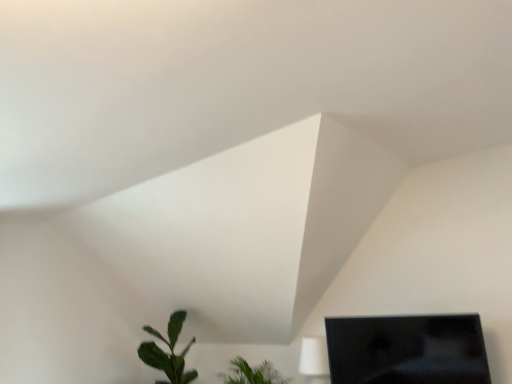
Question: From a real-world perspective, does black glossy monitor at lower right stand above green matte leafy plant at lower left, which appears as the 2th houseplant when viewed from the right?

Choices:
 (A) yes
 (B) no

Answer: (A)

Question: Is black glossy monitor at lower right aimed at green matte leafy plant at lower left, which appears as the 2th houseplant when viewed from the right?

Choices:
 (A) no
 (B) yes

Answer: (A)

Question: Does black glossy monitor at lower right have a larger size compared to green matte leafy plant at lower left, which appears as the 2th houseplant when viewed from the right?

Choices:
 (A) yes
 (B) no

Answer: (B)

Question: Is black glossy monitor at lower right next to green matte leafy plant at lower left, which is counted as the first houseplant, starting from the left, and touching it?

Choices:
 (A) yes
 (B) no

Answer: (B)

Question: From a real-world perspective, is black glossy monitor at lower right under green matte leafy plant at lower left, which appears as the 2th houseplant when viewed from the right?

Choices:
 (A) no
 (B) yes

Answer: (A)

Question: In terms of width, does green matte leafy plant at lower left, which is counted as the first houseplant, starting from the left, look wider or thinner when compared to black glossy monitor at lower right?

Choices:
 (A) wide
 (B) thin

Answer: (A)

Question: Is point (163, 354) closer or farther from the camera than point (388, 362)?

Choices:
 (A) farther
 (B) closer

Answer: (A)

Question: Is green matte leafy plant at lower left, which appears as the 2th houseplant when viewed from the right, taller or shorter than black glossy monitor at lower right?

Choices:
 (A) tall
 (B) short

Answer: (A)

Question: Is green matte leafy plant at lower left, which is counted as the first houseplant, starting from the left, inside or outside of black glossy monitor at lower right?

Choices:
 (A) inside
 (B) outside

Answer: (B)

Question: From the image's perspective, is black glossy monitor at lower right positioned above or below green matte leafy plant at lower left, which appears as the 2th houseplant when viewed from the right?

Choices:
 (A) below
 (B) above

Answer: (B)

Question: Based on their sizes in the image, would you say black glossy monitor at lower right is bigger or smaller than green matte leafy plant at lower left, which appears as the 2th houseplant when viewed from the right?

Choices:
 (A) small
 (B) big

Answer: (A)

Question: From a real-world perspective, relative to green matte leafy plant at lower left, which appears as the 2th houseplant when viewed from the right, is black glossy monitor at lower right vertically above or below?

Choices:
 (A) below
 (B) above

Answer: (B)

Question: Looking at their shapes, would you say black glossy monitor at lower right is wider or thinner than green matte leafy plant at lower left, which appears as the 2th houseplant when viewed from the right?

Choices:
 (A) thin
 (B) wide

Answer: (A)

Question: From their relative heights in the image, would you say green matte leafy plant at lower left, which appears as the 2th houseplant when viewed from the right, is taller or shorter than green leafy plant at lower center, the 1th houseplant positioned from the right?

Choices:
 (A) tall
 (B) short

Answer: (A)

Question: Looking at the image, does green matte leafy plant at lower left, which appears as the 2th houseplant when viewed from the right, seem bigger or smaller compared to green leafy plant at lower center, acting as the second houseplant starting from the left?

Choices:
 (A) small
 (B) big

Answer: (B)